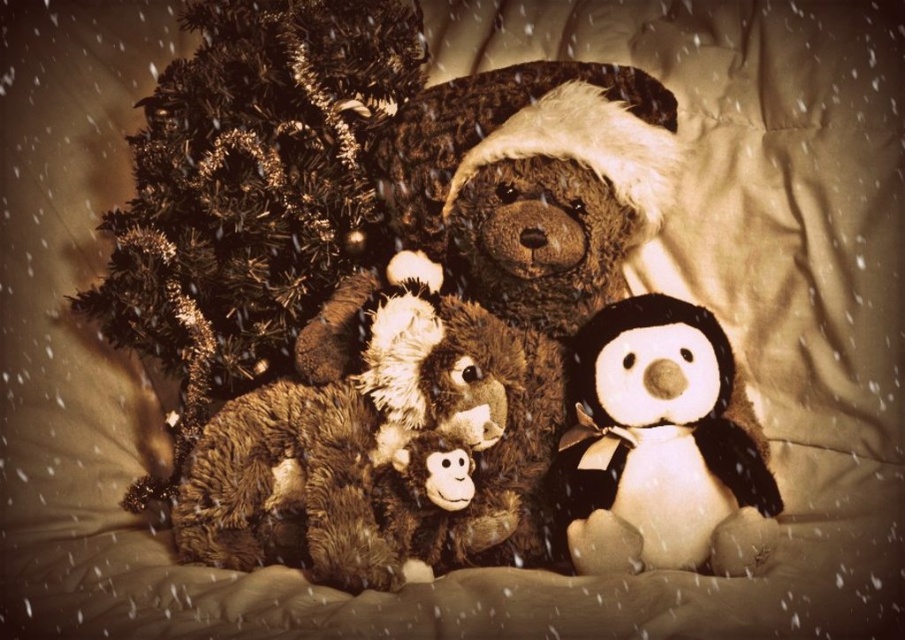
Which is in front, point (260, 392) or point (650, 548)?

Point (650, 548) is more forward.

Who is higher up, fuzzy brown teddy bear at center or white plush penguin at center?

Positioned higher is fuzzy brown teddy bear at center.

Is point (287, 410) closer to viewer compared to point (705, 413)?

That is False.

Image resolution: width=905 pixels, height=640 pixels. I want to click on fuzzy brown teddy bear at center, so click(x=443, y=333).